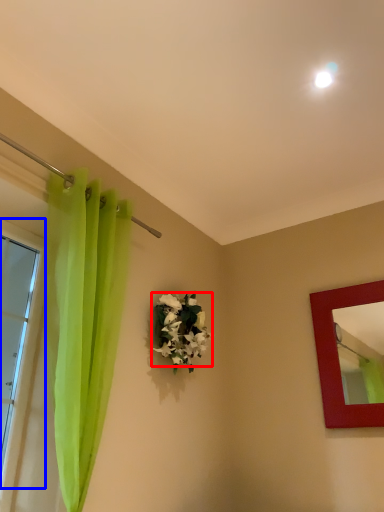
Question: Which object is further to the camera taking this photo, flower (highlighted by a red box) or window (highlighted by a blue box)?

Choices:
 (A) flower
 (B) window

Answer: (A)